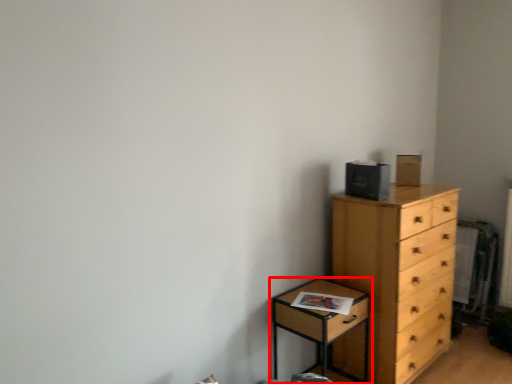
Question: Observing the image, what is the correct spatial positioning of nightstand (annotated by the red box) in reference to chest of drawers?

Choices:
 (A) right
 (B) left

Answer: (B)